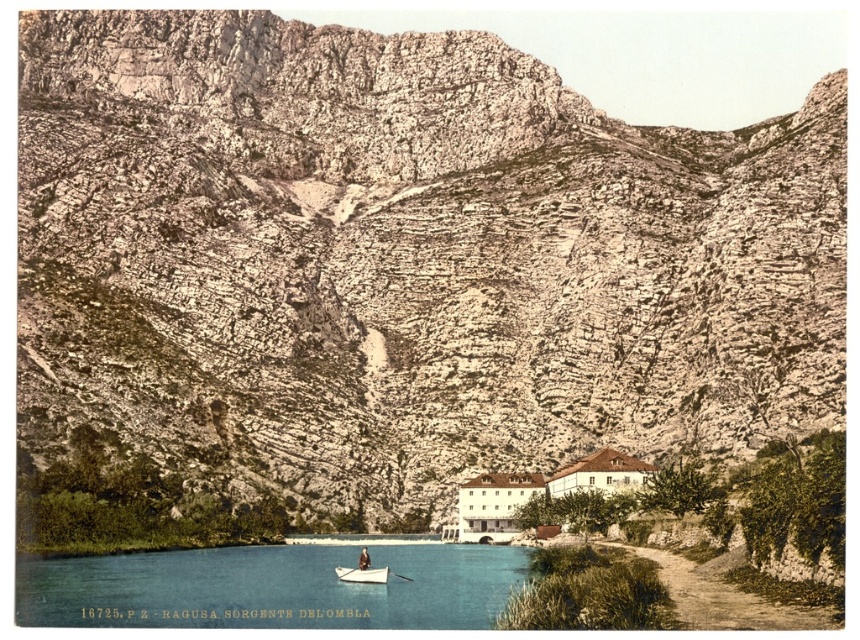
You are standing at the edge of the blue glassy river at lower center and want to cross it to reach the dark brown leather jacket at center. Do you think you can walk across the river without getting wet?

The blue glassy river at lower center might be wider than dark brown leather jacket at center, so it is uncertain whether you can cross without getting wet. The width of the river is uncertain based on the given information.

You are a photographer standing at the camera position. You want to take a photo of the dark brown leather jacket at center. However, there is a small white boat anchored near the shore in the midground. Do you think the boat will block your view of the jacket?

The dark brown leather jacket at center is 85.14 meters away from the camera, which is farther than the small white boat in the midground. Therefore, the boat is closer to the camera and will block the view of the jacket.

You are standing on the shore looking at the white matte boat at lower center and the white wood paddle at lower center. Which object is nearer to you?

The white matte boat at lower center is closer to the viewer than the white wood paddle at lower center.